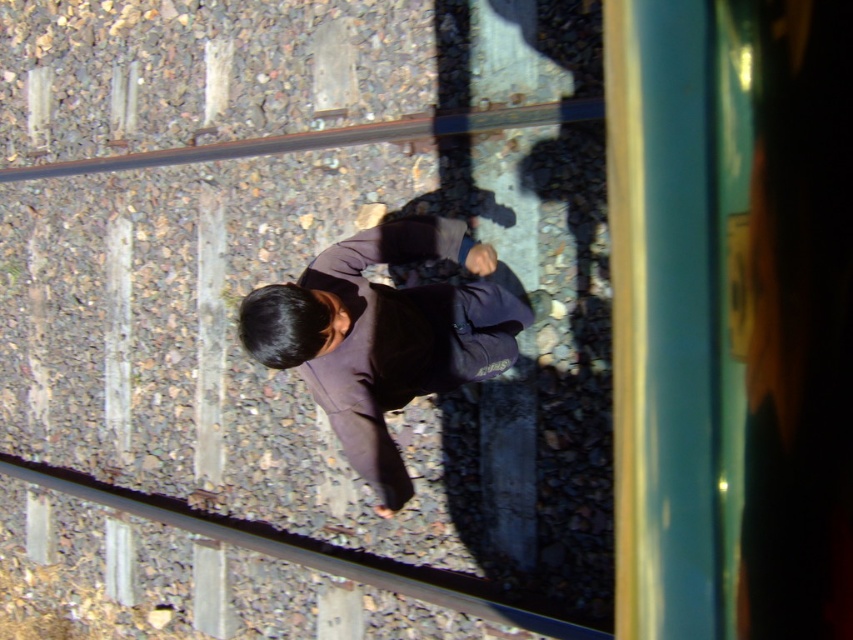
You are a passenger on the train and notice the dark brown fabric at center on the tracks ahead. Your train is moving at 30 km per hour. Can you estimate if there is enough time to stop before hitting the fabric?

The dark brown fabric at center is 2.78 meters from the camera. At 30 km per hour, the train would need approximately 0.23 seconds to stop, which is insufficient time to avoid collision. Immediate action is required.

You are a passenger sitting in the train and looking out through the window. There is a point at coordinate (289, 280). Is this point located on the green glass train window at upper right?

Yes, the point (289, 280) is on the green glass train window at upper right according to the description.

You are a passenger on the train and notice two items in your view from the window. The dark brown fabric at center and the metal at bottom. Which of these two items is narrower in width?

The dark brown fabric at center is thinner than the metal at bottom, so the dark brown fabric at center is narrower in width.